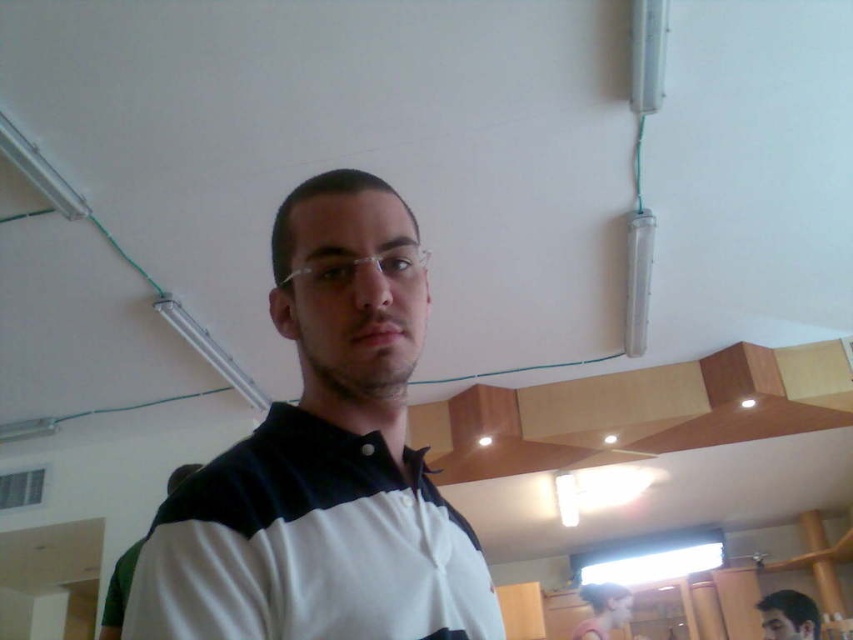
Question: Does white matte shirt at center have a smaller size compared to white striped polo shirt at center?

Choices:
 (A) no
 (B) yes

Answer: (B)

Question: Which object is positioned closest to the white matte shirt at center?

Choices:
 (A) white striped polo shirt at center
 (B) clear plastic glasses at center
 (C) smooth brown hair at lower right

Answer: (B)

Question: Does white matte shirt at center have a smaller size compared to white striped polo shirt at center?

Choices:
 (A) yes
 (B) no

Answer: (A)

Question: Which object is the farthest from the white matte shirt at center?

Choices:
 (A) white striped polo shirt at center
 (B) smooth brown hair at lower right

Answer: (B)

Question: Which of these objects is positioned closest to the clear plastic glasses at center?

Choices:
 (A) smooth brown hair at lower right
 (B) white matte shirt at center

Answer: (B)

Question: Does white matte shirt at center appear on the left side of clear plastic glasses at center?

Choices:
 (A) no
 (B) yes

Answer: (A)